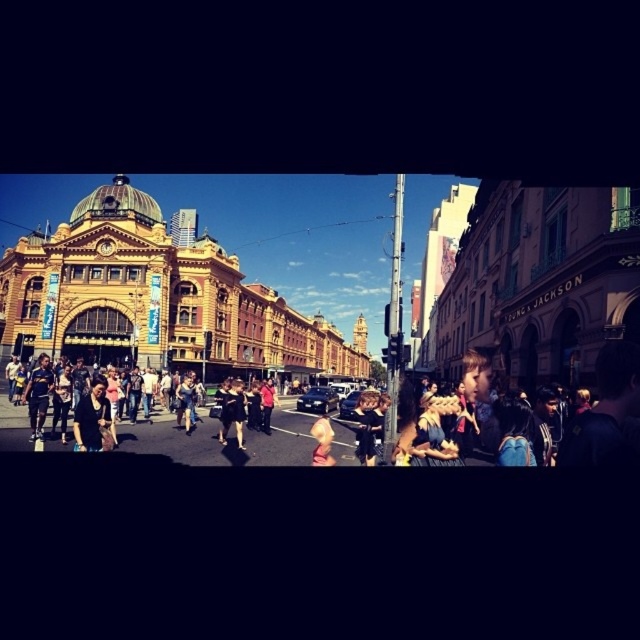
You are a photographer standing in the crowd and want to take a photo of the matte black jacket at center and the light brown hair at center. Which object should you focus on first to ensure both are in focus?

You should focus on the matte black jacket at center first because it is closer to the viewer than the light brown hair at center, so adjusting focus from near to far will help both be in focus.